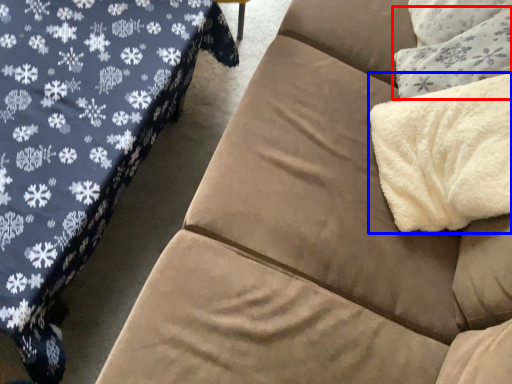
Question: Which point is closer to the camera, throw pillow (highlighted by a red box) or blanket (highlighted by a blue box)?

Choices:
 (A) throw pillow
 (B) blanket

Answer: (B)